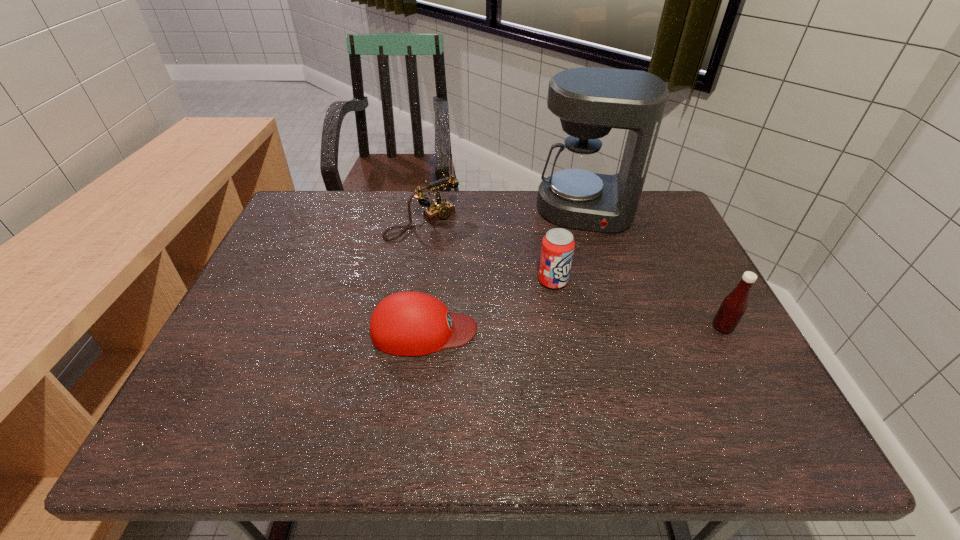
Identify the location of object that is positioned at the far right corner. (590, 101).

The image size is (960, 540). I want to click on vacant space at the far edge of the desktop, so click(382, 191).

The width and height of the screenshot is (960, 540). In the image, there is a desktop. What are the coordinates of `vacant space at the near edge` in the screenshot? It's located at (337, 386).

In the image, there is a desktop. Identify the location of vacant space at the left edge. (273, 289).

This screenshot has width=960, height=540. I want to click on vacant position at the right edge of the desktop, so click(734, 334).

I want to click on free spot at the near left corner of the desktop, so click(251, 390).

This screenshot has height=540, width=960. In order to click on free space at the near right corner of the desktop in this screenshot , I will do `click(718, 392)`.

Where is `free point between the telephone and the third nearest object`? free point between the telephone and the third nearest object is located at coordinates (488, 252).

Identify the location of free space between the telephone and the baseball cap. tap(423, 276).

The width and height of the screenshot is (960, 540). What are the coordinates of `free spot between the baseball cap and the tallest object` in the screenshot? It's located at pyautogui.click(x=505, y=271).